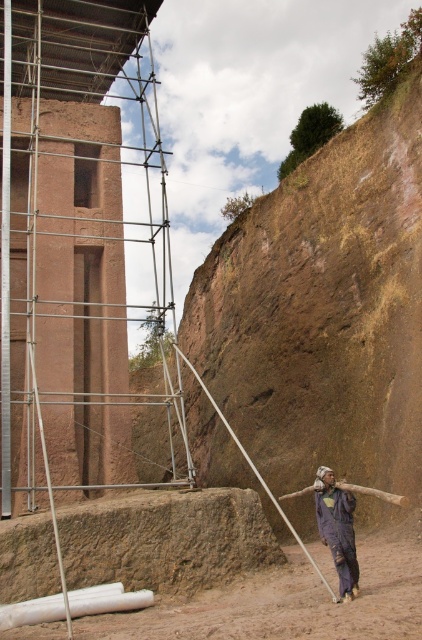
You are standing at the center of the image and want to walk to the brown dirt field at lower right. Which direction should you move in?

The brown dirt field at lower right is located at point 0.942 on the x axis and 0.680 on the y axis. Since you are at the center, you need to move towards the right and slightly upwards to reach it.

You are a construction worker at the site and need to place a heavy equipment on a flat surface. Which area between the brown dirt field at lower right and the dark blue fabric at lower center would be more suitable for placing the equipment?

The brown dirt field at lower right is larger in size than the dark blue fabric at lower center, making it more suitable for placing heavy equipment as it can accommodate the equipment better due to its larger area.

You are a construction worker who needs to transport a heavy tool from the brown dirt field at lower right to the dark blue fabric at lower center. Which area requires more space to maneuver the tool?

The brown dirt field at lower right requires more space to maneuver the tool because its width is larger than the dark blue fabric at lower center.